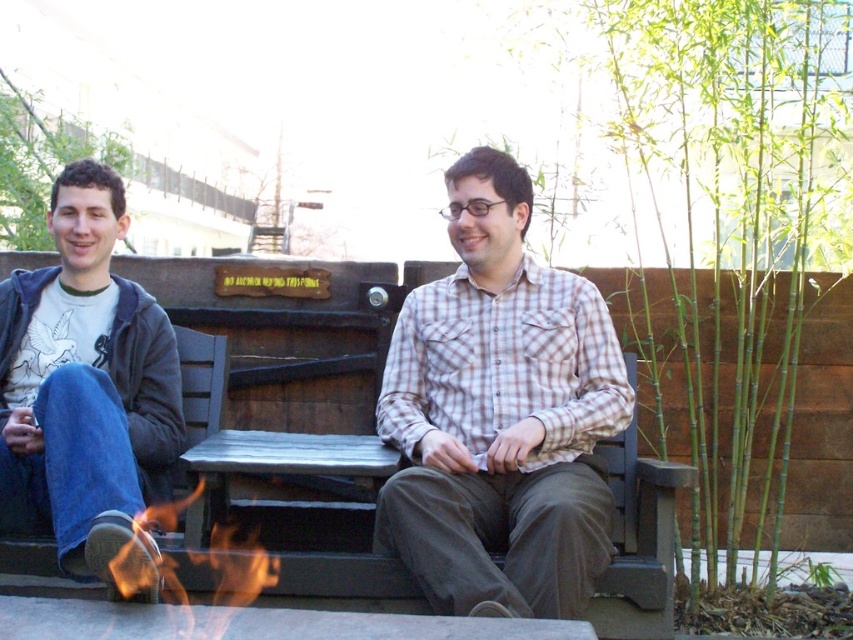
In the scene shown: Between matte plaid shirt at center and plaid cotton shirt at center, which one is positioned lower?

Positioned lower is matte plaid shirt at center.

Does matte plaid shirt at center lie in front of plaid cotton shirt at center?

Yes, it is in front of plaid cotton shirt at center.

Is point (502, 337) closer to viewer compared to point (570, 547)?

That is False.

I want to click on matte plaid shirt at center, so click(474, 420).

Between matte plaid shirt at center and flame/yellow-orange at lower center, which one has less height?

flame/yellow-orange at lower center

Does point (553, 268) come behind point (138, 529)?

Yes, it is.

Between point (350, 461) and point (276, 566), which one is positioned in front?

Point (276, 566) is more forward.

I want to click on matte plaid shirt at center, so click(474, 420).

Which is in front, point (170, 433) or point (236, 582)?

Point (236, 582) is more forward.

Which is behind, point (90, 355) or point (263, 573)?

The point (90, 355) is behind.

What do you see at coordinates (84, 385) in the screenshot? I see `denim jacket at left` at bounding box center [84, 385].

You are a GUI agent. You are given a task and a screenshot of the screen. Output one action in this format:
    pyautogui.click(x=<x>, y=<y>)
    Task: Click on the denim jacket at left
    
    Given the screenshot: What is the action you would take?
    pyautogui.click(x=84, y=385)